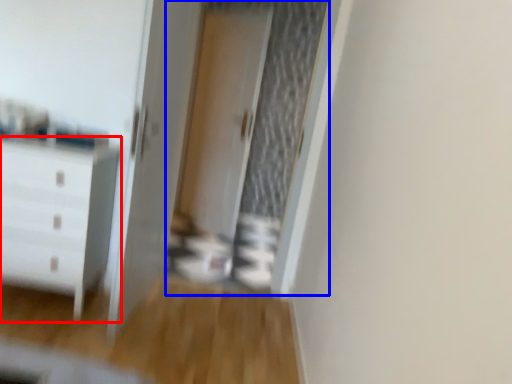
Question: Which object appears farthest to the camera in this image, chest of drawers (highlighted by a red box) or screen door (highlighted by a blue box)?

Choices:
 (A) chest of drawers
 (B) screen door

Answer: (B)